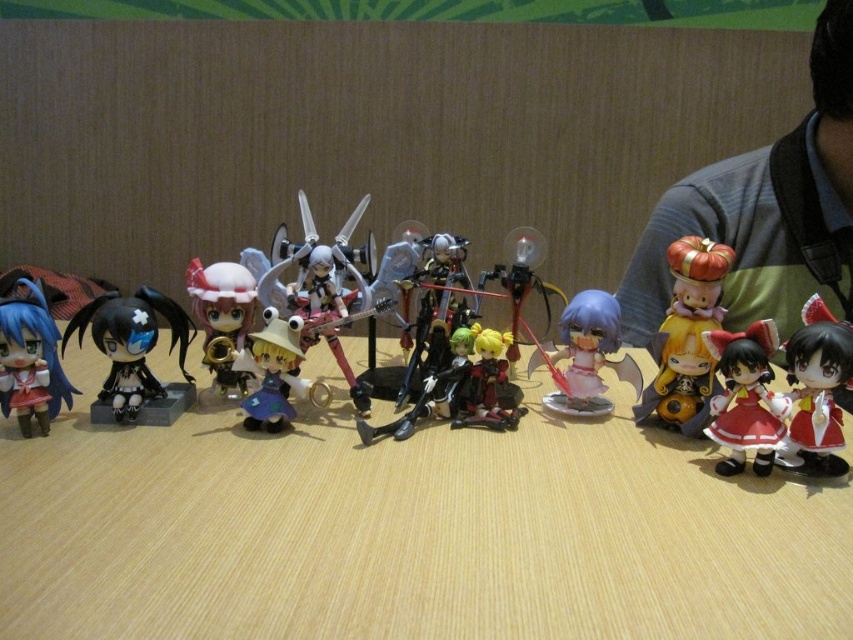
Question: Among these objects, which one is nearest to the camera?

Choices:
 (A) matte plastic figurines at center
 (B) matte red dress at lower right

Answer: (B)

Question: Is wooden table at center thinner than red glossy doll at lower right?

Choices:
 (A) no
 (B) yes

Answer: (A)

Question: Does matte plastic figure at center have a larger size compared to shiny silver sword at center?

Choices:
 (A) yes
 (B) no

Answer: (B)

Question: Among these points, which one is farthest from the camera?

Choices:
 (A) (589, 339)
 (B) (744, 444)
 (C) (547, 289)

Answer: (C)

Question: Which point appears farthest from the camera in this image?

Choices:
 (A) (589, 403)
 (B) (689, 378)
 (C) (329, 262)
 (D) (234, 333)

Answer: (A)

Question: Does matte black figurine at left have a larger size compared to matte blue hair at left?

Choices:
 (A) yes
 (B) no

Answer: (A)